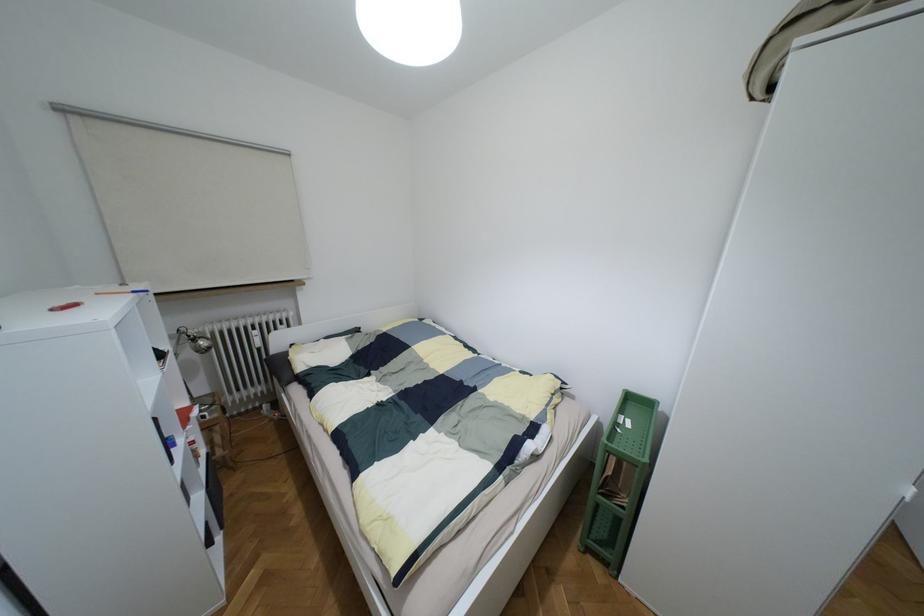
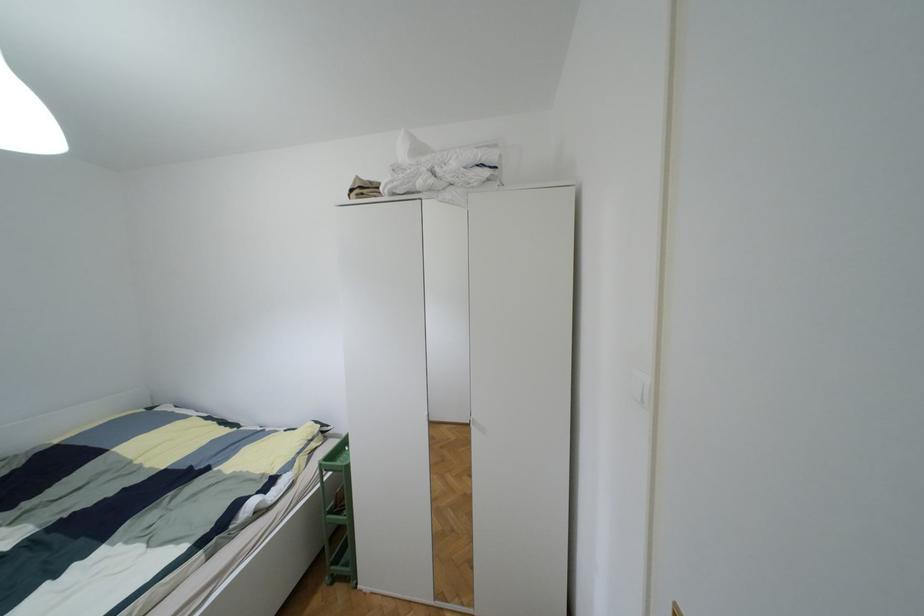
Find the pixel in the second image that matches pixel 588 551 in the first image.

(333, 578)